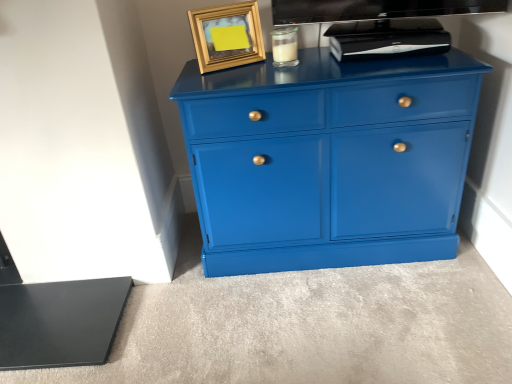
Question: Are gold metallic picture frame at upper center and glossy blue cabinet at center located far from each other?

Choices:
 (A) no
 (B) yes

Answer: (A)

Question: Is gold metallic picture frame at upper center in contact with glossy blue cabinet at center?

Choices:
 (A) no
 (B) yes

Answer: (A)

Question: Would you say gold metallic picture frame at upper center is outside glossy blue cabinet at center?

Choices:
 (A) yes
 (B) no

Answer: (A)

Question: From the image's perspective, is gold metallic picture frame at upper center over glossy blue cabinet at center?

Choices:
 (A) yes
 (B) no

Answer: (A)

Question: From a real-world perspective, is gold metallic picture frame at upper center physically above glossy blue cabinet at center?

Choices:
 (A) no
 (B) yes

Answer: (B)

Question: Visually, is clear glass jar at upper center positioned to the left or to the right of glossy blue cabinet at center?

Choices:
 (A) left
 (B) right

Answer: (A)

Question: In terms of width, does clear glass jar at upper center look wider or thinner when compared to glossy blue cabinet at center?

Choices:
 (A) thin
 (B) wide

Answer: (A)

Question: Do you think clear glass jar at upper center is within glossy blue cabinet at center, or outside of it?

Choices:
 (A) inside
 (B) outside

Answer: (B)

Question: Considering their positions, is clear glass jar at upper center located in front of or behind glossy blue cabinet at center?

Choices:
 (A) front
 (B) behind

Answer: (B)

Question: Is black plastic device at upper center in front of or behind clear glass jar at upper center in the image?

Choices:
 (A) behind
 (B) front

Answer: (B)

Question: In terms of width, does black plastic device at upper center look wider or thinner when compared to clear glass jar at upper center?

Choices:
 (A) wide
 (B) thin

Answer: (A)

Question: Looking at the image, does black plastic device at upper center seem bigger or smaller compared to clear glass jar at upper center?

Choices:
 (A) small
 (B) big

Answer: (B)

Question: Is point (444, 39) closer or farther from the camera than point (276, 64)?

Choices:
 (A) farther
 (B) closer

Answer: (A)

Question: In terms of width, does black plastic device at upper center look wider or thinner when compared to gold metallic picture frame at upper center?

Choices:
 (A) wide
 (B) thin

Answer: (A)

Question: In terms of size, does black plastic device at upper center appear bigger or smaller than gold metallic picture frame at upper center?

Choices:
 (A) big
 (B) small

Answer: (A)